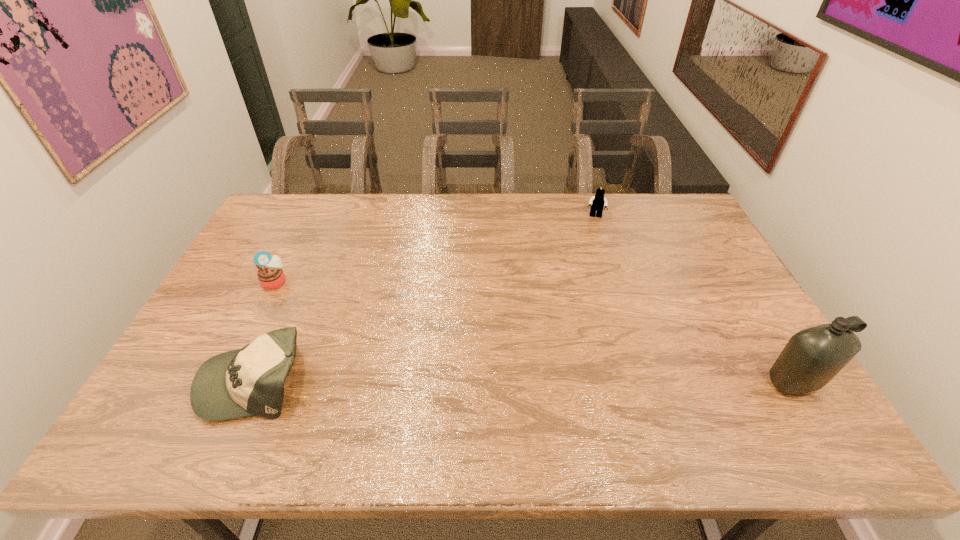
Locate an element on the screen. free point that satisfies the following two spatial constraints: 1. on the back side of the second farthest object; 2. on the left side of the third object from left to right is located at coordinates (306, 217).

This screenshot has width=960, height=540. What are the coordinates of `blank area in the image that satisfies the following two spatial constraints: 1. on the front side of the rightmost object; 2. on the left side of the second farthest object` in the screenshot? It's located at (226, 382).

This screenshot has height=540, width=960. In order to click on vacant space that satisfies the following two spatial constraints: 1. on the front side of the baseball cap; 2. on the front-facing side of the third nearest object in this screenshot , I will do `click(227, 380)`.